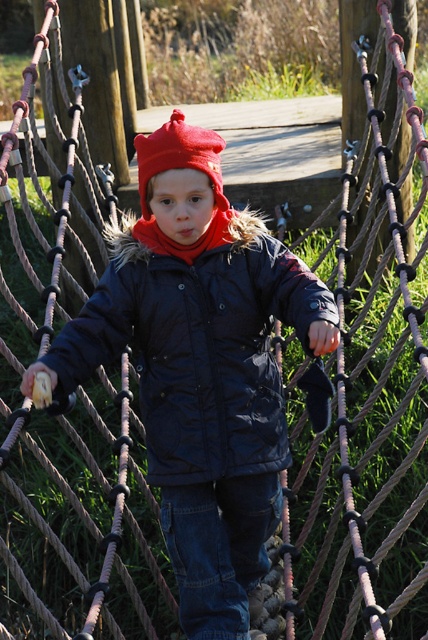
You are an engineer analyzing the position of the dark blue quilted jacket at center in the image. What are the coordinates of its 2D location?

The 2D location of the dark blue quilted jacket at center is at point (199, 348).